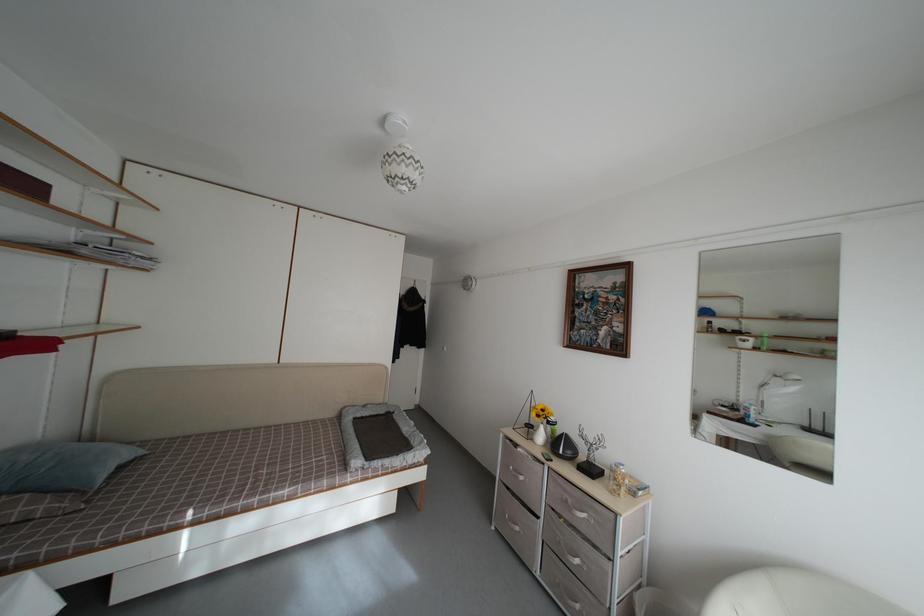
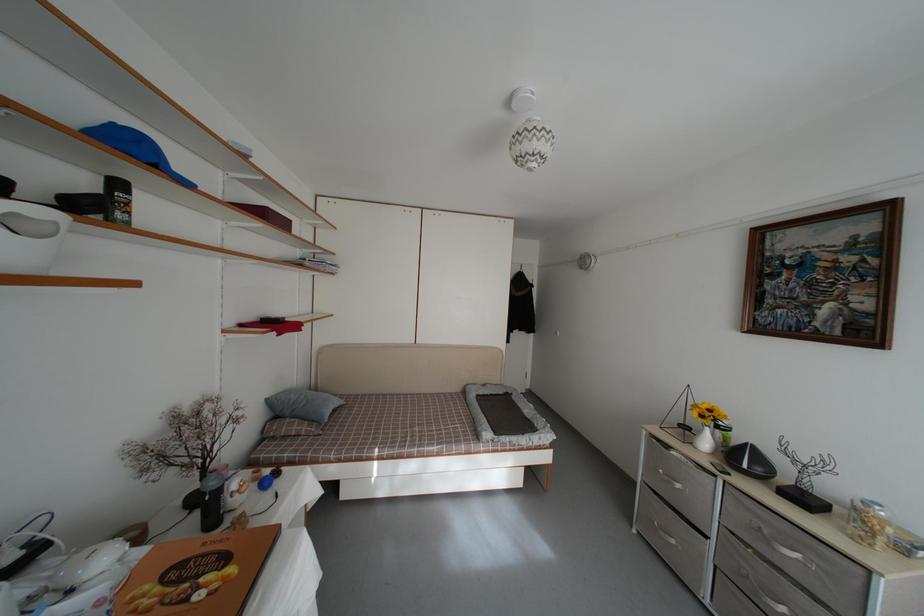
Where in the second image is the point corresponding to point (395, 421) from the first image?

(513, 402)